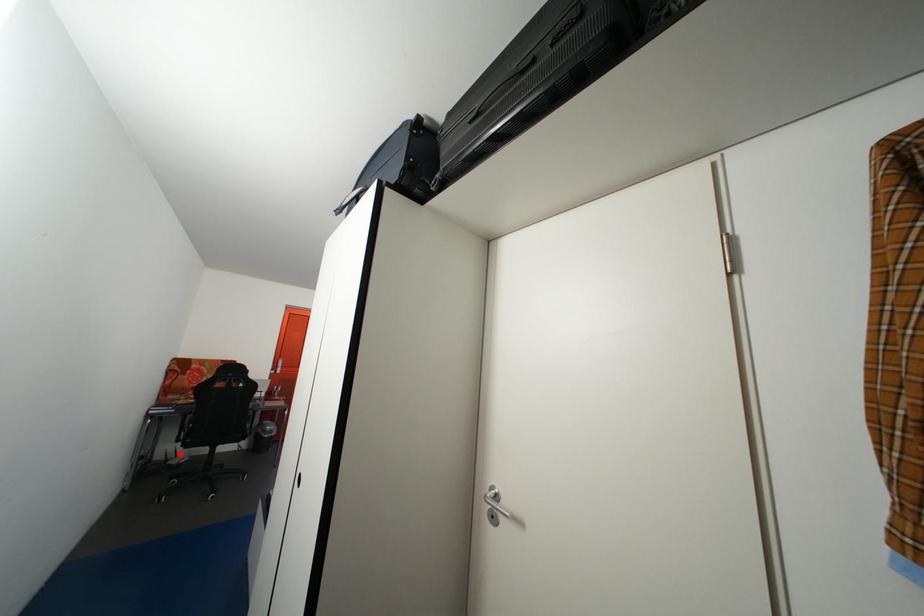
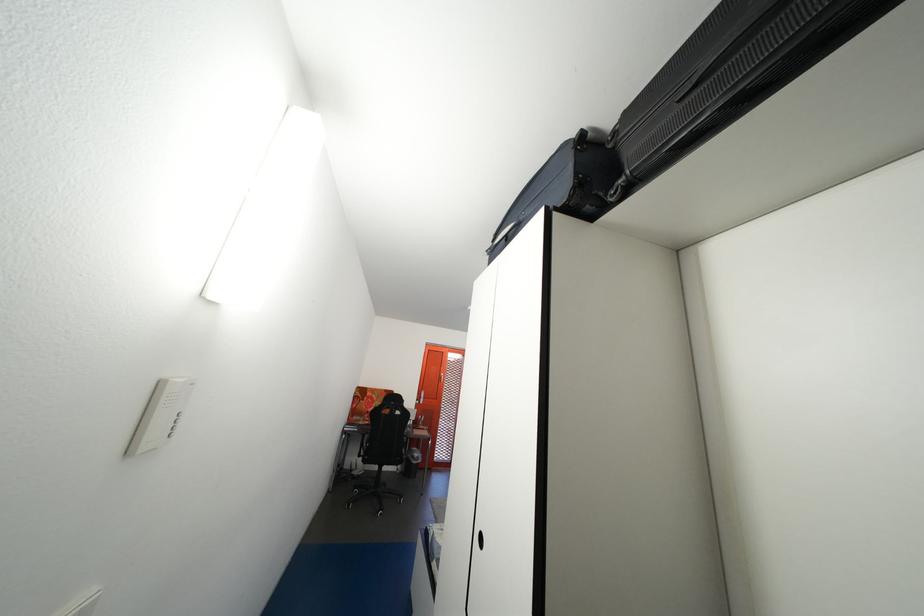
The point at the highlighted location is marked in the first image. Where is the corresponding point in the second image?

(365, 467)